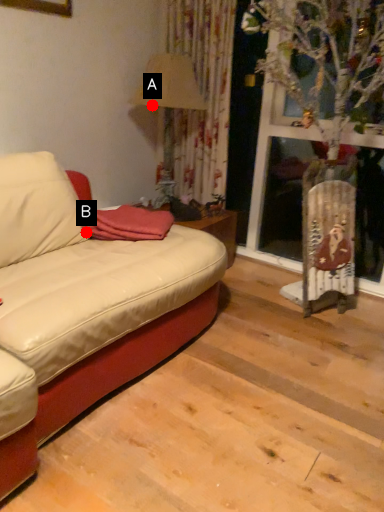
Question: Two points are circled on the image, labeled by A and B beside each circle. Which point is farther from the camera taking this photo?

Choices:
 (A) A is further
 (B) B is further

Answer: (A)